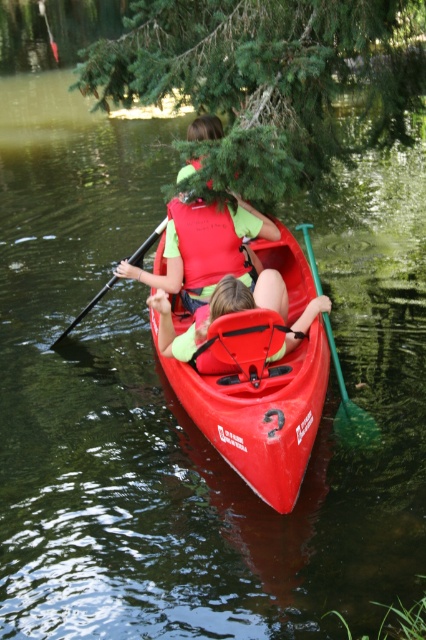
Question: Does matte green life jacket at center have a larger size compared to black plastic paddle at center?

Choices:
 (A) no
 (B) yes

Answer: (A)

Question: Considering the real-world distances, which object is farthest from the green plastic paddle at lower center?

Choices:
 (A) matte red kayak at center
 (B) matte green life jacket at center
 (C) black plastic paddle at center

Answer: (C)

Question: Among these objects, which one is farthest from the camera?

Choices:
 (A) matte red kayak at center
 (B) matte green life vest at center
 (C) matte green life jacket at center
 (D) black plastic paddle at center

Answer: (D)

Question: Is matte green life vest at center closer to the viewer compared to black plastic paddle at center?

Choices:
 (A) yes
 (B) no

Answer: (A)

Question: Which of the following is the closest to the observer?

Choices:
 (A) green plastic paddle at lower center
 (B) matte red kayak at center

Answer: (B)

Question: Is matte green life jacket at center to the left of black plastic paddle at center from the viewer's perspective?

Choices:
 (A) yes
 (B) no

Answer: (B)